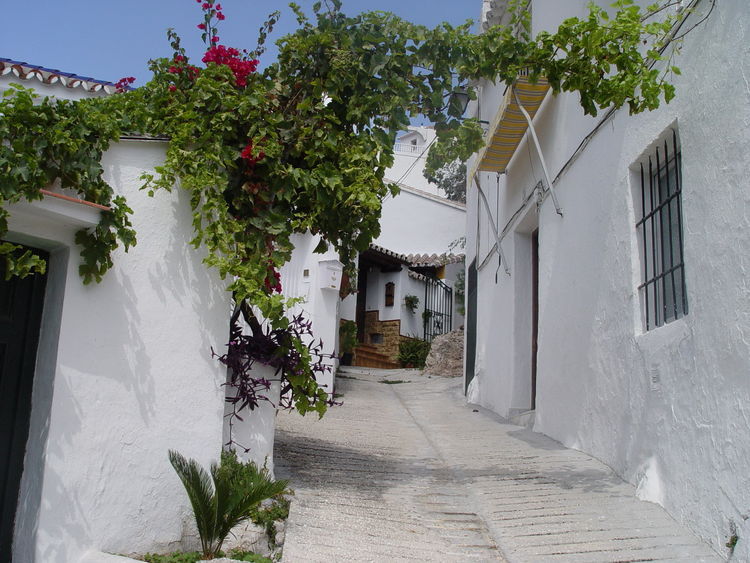
You are a GUI agent. You are given a task and a screenshot of the screen. Output one action in this format:
    pyautogui.click(x=<x>, y=<y>)
    Task: Click on the window
    This screenshot has height=563, width=750.
    Given the screenshot: What is the action you would take?
    pyautogui.click(x=664, y=233)